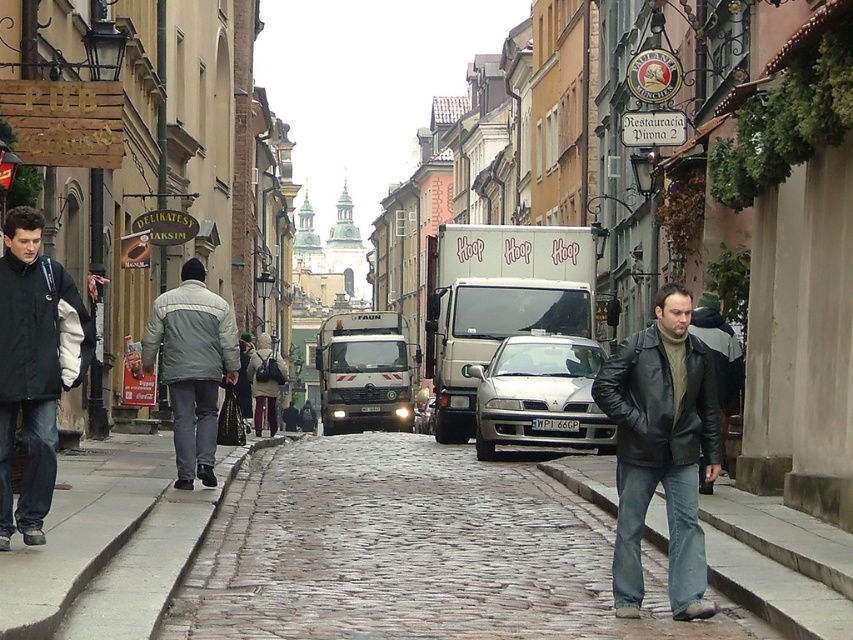
Question: Where is cobblestone pavement at center located in relation to leather jacket at center in the image?

Choices:
 (A) below
 (B) above

Answer: (A)

Question: Which point is closer to the camera taking this photo?

Choices:
 (A) 236,376
 (B) 38,397

Answer: (B)

Question: Which point is closer to the camera?

Choices:
 (A) leather jacket at center
 (B) dark gray jacket at left

Answer: (B)

Question: In this image, where is cobblestone pavement at center located relative to leather jacket at right?

Choices:
 (A) below
 (B) above

Answer: (A)

Question: Which object is positioned closest to the gray fleece jacket at left?

Choices:
 (A) dark gray jacket at left
 (B) leather jacket at center
 (C) silver metallic sedan at center

Answer: (A)

Question: Can you confirm if leather jacket at center is positioned above silver metallic sedan at center?

Choices:
 (A) no
 (B) yes

Answer: (B)